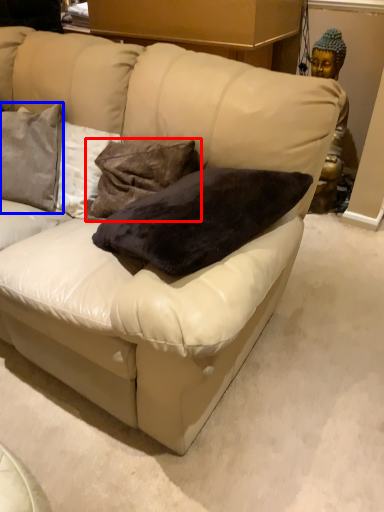
Question: Which object appears closest to the camera in this image, pillow (highlighted by a red box) or pillow (highlighted by a blue box)?

Choices:
 (A) pillow
 (B) pillow

Answer: (A)